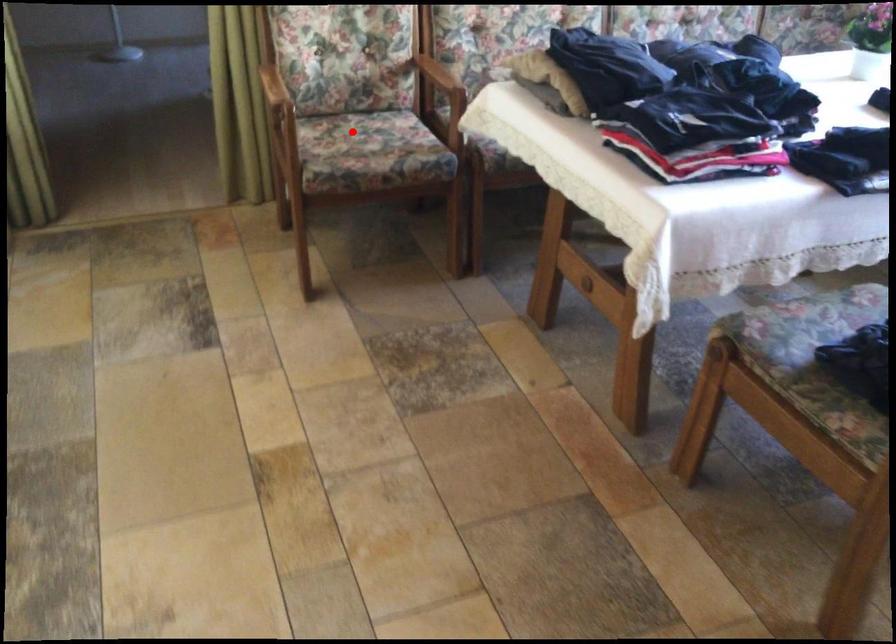
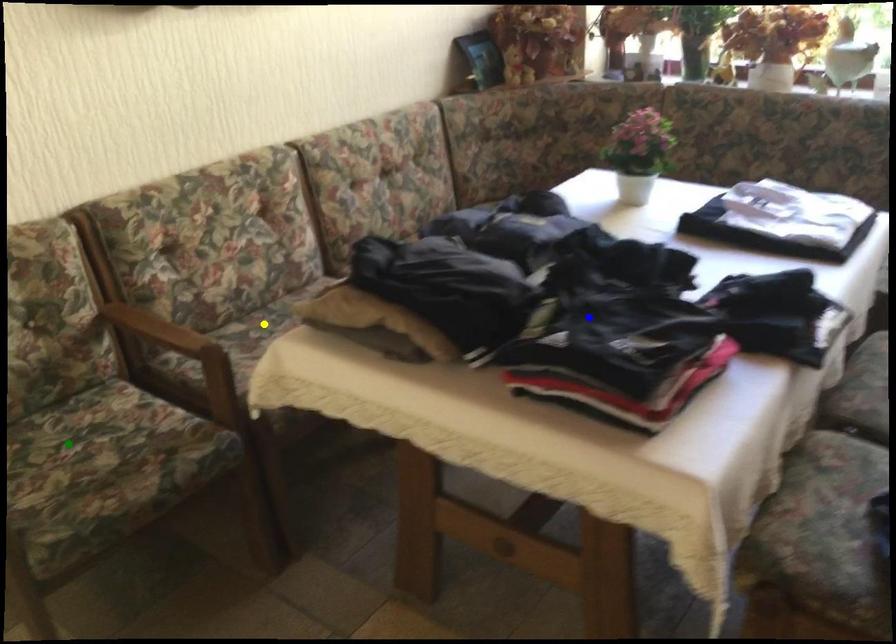
Question: I am providing you with two images of the same scene from different viewpoints. A red point is marked on the first image. You are given multiple points on the second image. Which spot in image 2 lines up with the point in image 1?

Choices:
 (A) yellow point
 (B) green point
 (C) blue point

Answer: (B)